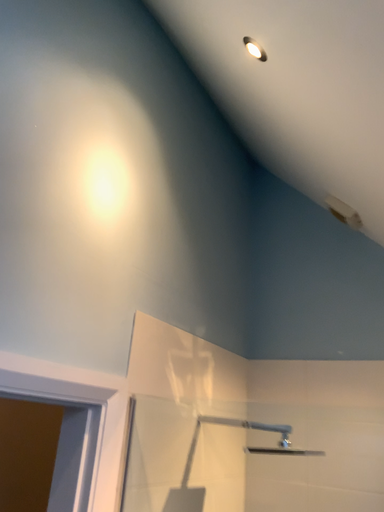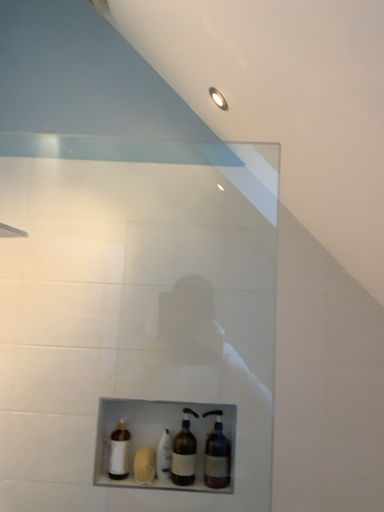
Question: Which way did the camera rotate in the video?

Choices:
 (A) rotated left
 (B) rotated right

Answer: (B)